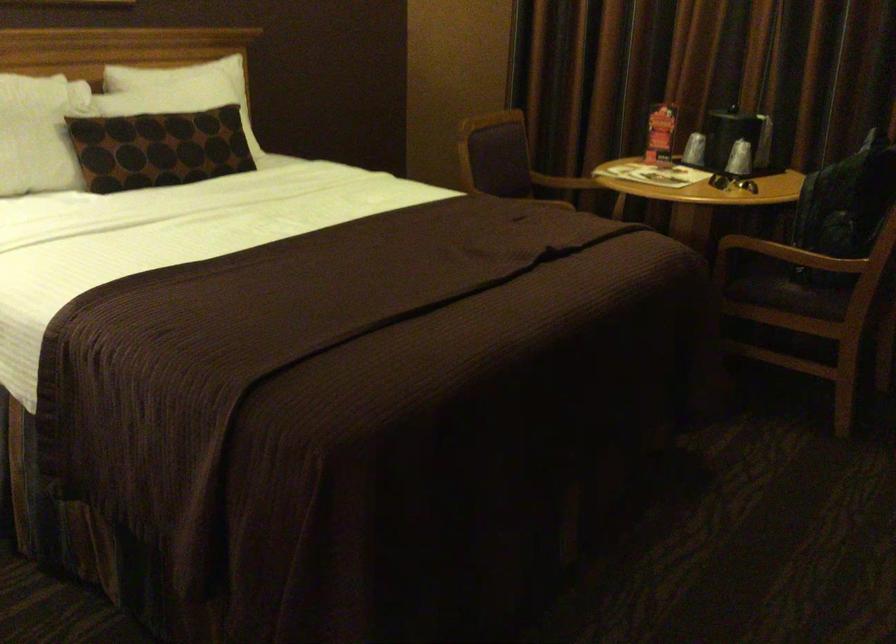
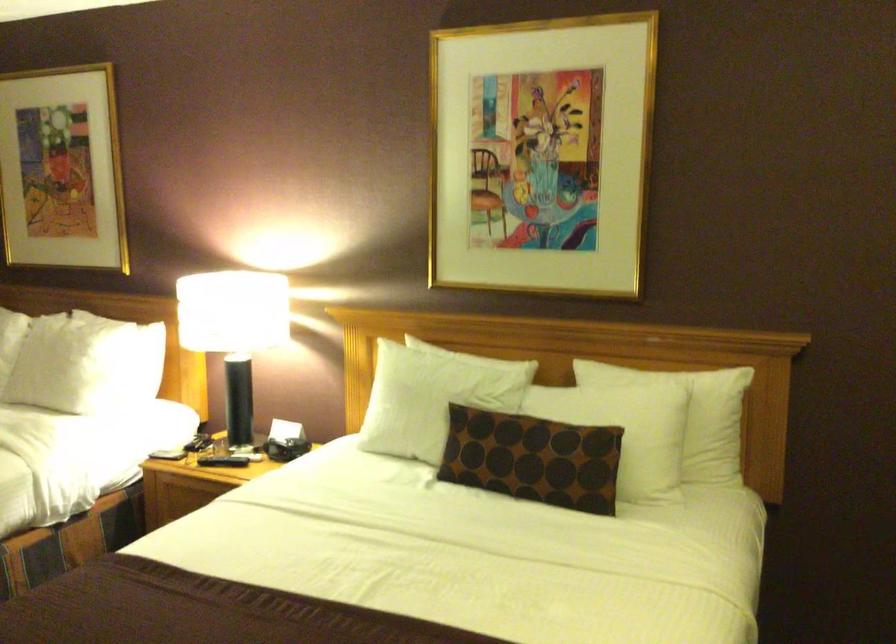
Where in the second image is the point corresponding to point (186, 144) from the first image?

(532, 458)